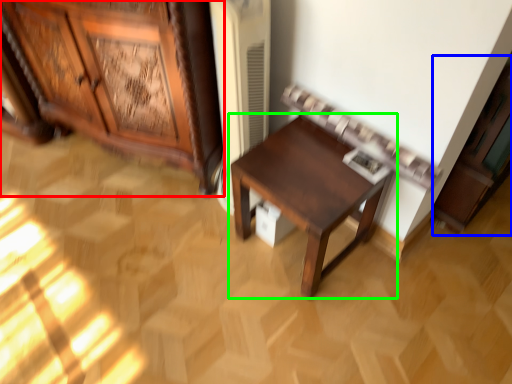
Question: Based on their relative distances, which object is farther from cabinetry (highlighted by a red box)? Choose from cabinetry (highlighted by a blue box) and table (highlighted by a green box).

Choices:
 (A) cabinetry
 (B) table

Answer: (A)